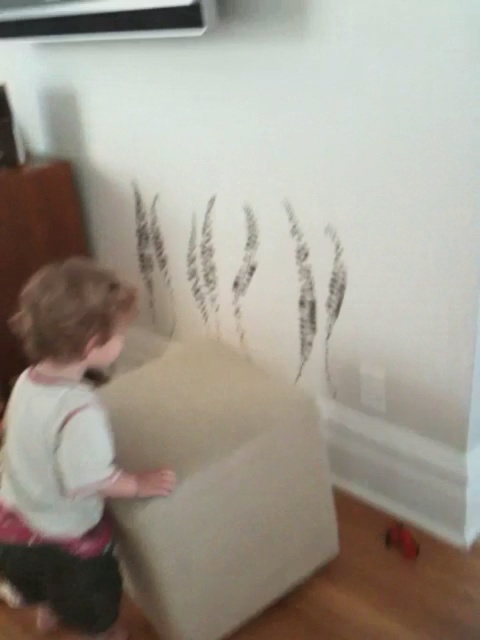
Question: Among these objects, which one is nearest to the camera?

Choices:
 (A) black paper at center
 (B) rubberized red toy at lower right
 (C) white cotton toddler at center

Answer: (C)

Question: Can you confirm if black paper at center is positioned below rubberized red toy at lower right?

Choices:
 (A) yes
 (B) no

Answer: (B)

Question: Which of the following is the farthest from the observer?

Choices:
 (A) (300, 294)
 (B) (407, 545)

Answer: (A)

Question: Is white cotton toddler at center further to camera compared to black paper at center?

Choices:
 (A) yes
 (B) no

Answer: (B)

Question: Which object is farther from the camera taking this photo?

Choices:
 (A) rubberized red toy at lower right
 (B) white cotton toddler at center
 (C) black paper at center

Answer: (C)

Question: Does black paper at center appear under rubberized red toy at lower right?

Choices:
 (A) yes
 (B) no

Answer: (B)